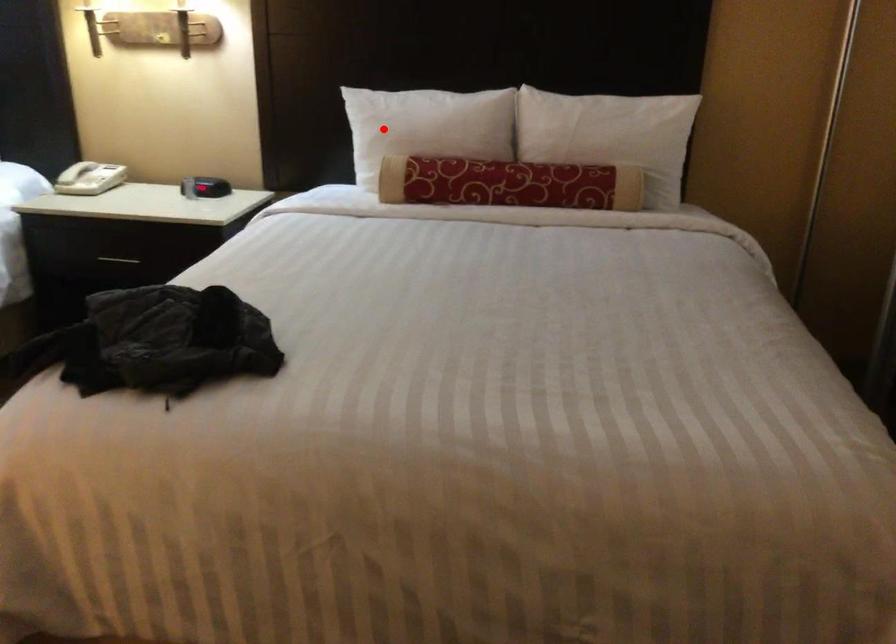
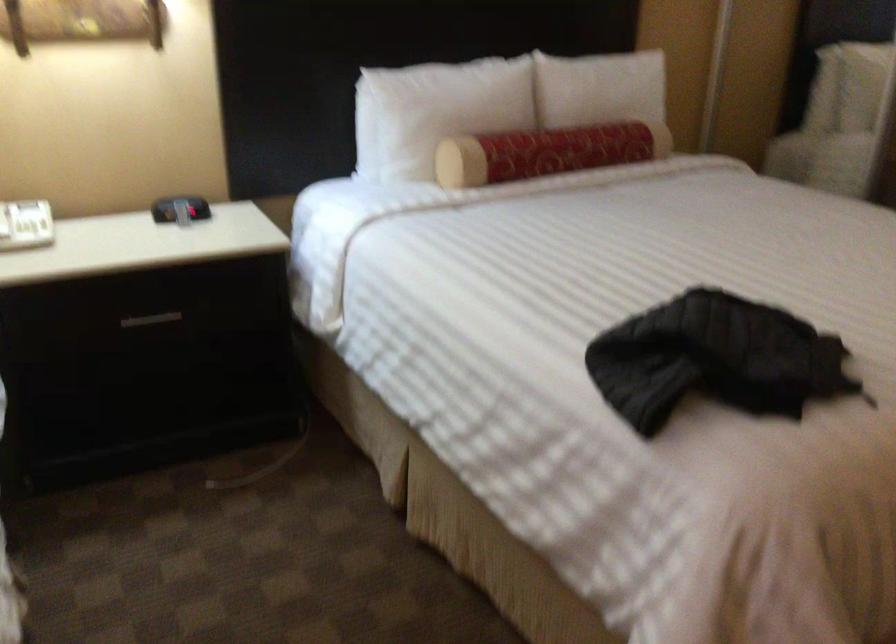
The point at the highlighted location is marked in the first image. Where is the corresponding point in the second image?

(435, 111)